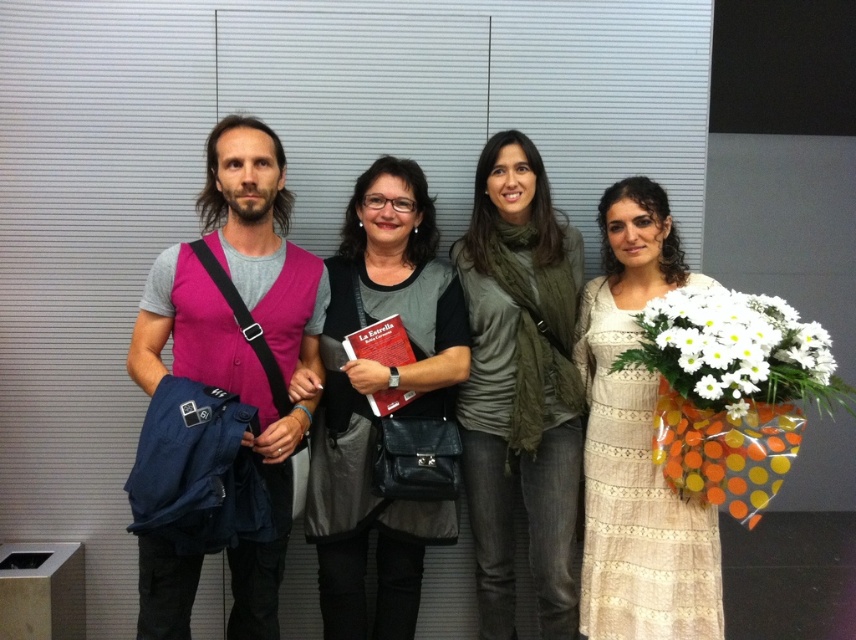
Question: Is beige lace dress at center positioned before white fabric bouquet at right?

Choices:
 (A) yes
 (B) no

Answer: (B)

Question: Can you confirm if matte black book at center is bigger than beige lace dress at center?

Choices:
 (A) yes
 (B) no

Answer: (A)

Question: Estimate the real-world distances between objects in this image. Which object is farther from the pink fabric vest at left?

Choices:
 (A) matte black book at center
 (B) white fabric bouquet at right
 (C) green matte scarf at center

Answer: (B)

Question: Which of these objects is positioned farthest from the white fabric bouquet at right?

Choices:
 (A) beige lace dress at center
 (B) pink fabric vest at left

Answer: (B)

Question: Which of the following is the closest to the observer?

Choices:
 (A) (711, 448)
 (B) (767, 381)

Answer: (B)

Question: Does green matte scarf at center lie behind white fabric bouquet at right?

Choices:
 (A) no
 (B) yes

Answer: (B)